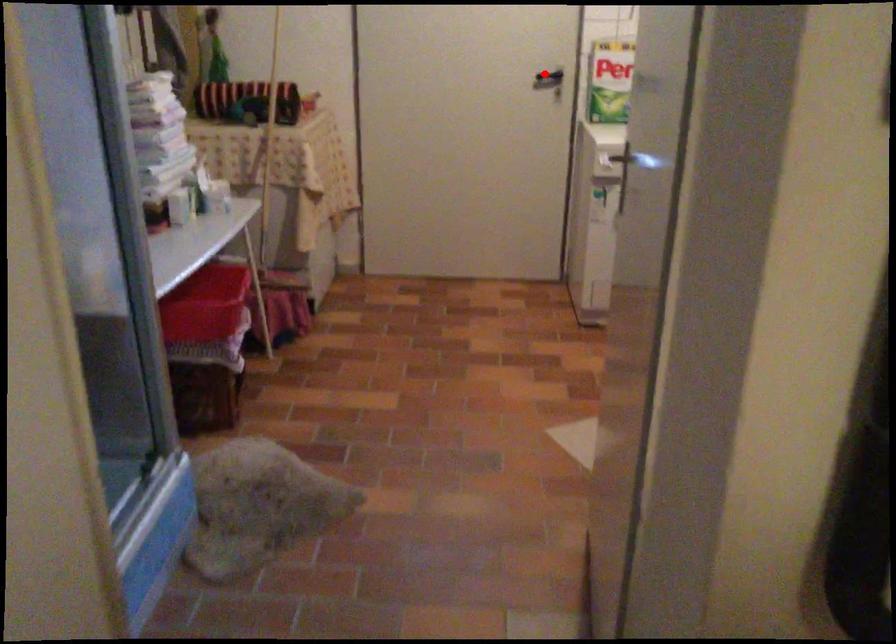
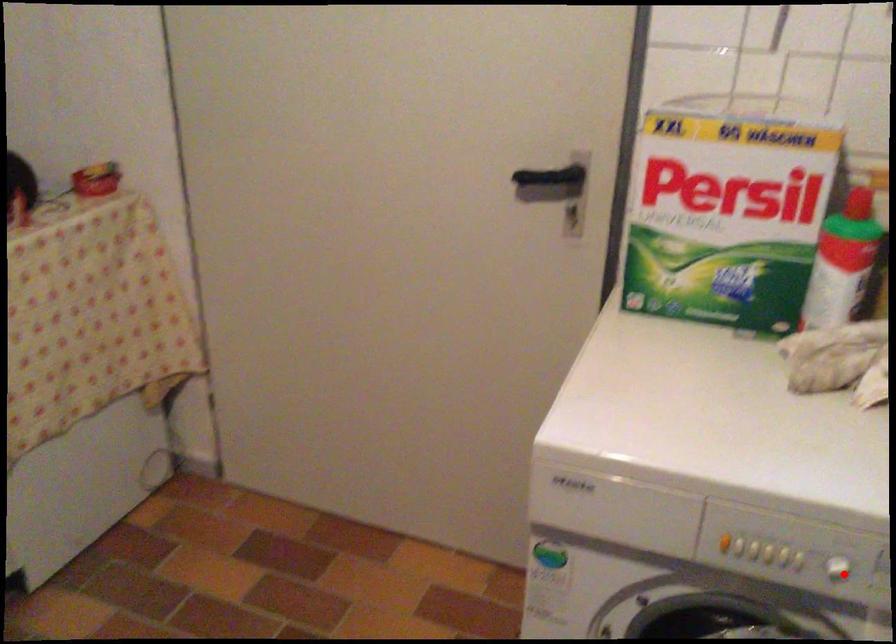
I am providing you with two images of the same scene from different viewpoints. A red point is marked on the first image and another point is marked on the second image. Is the red point in image1 aligned with the point shown in image2?

No